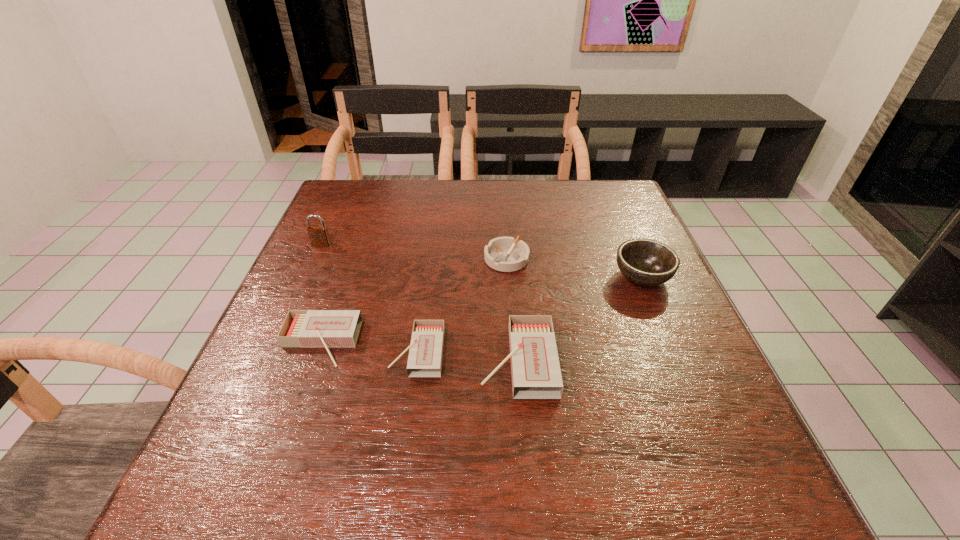
I want to click on matchbox that can be found as the closest to the rightmost matchbox, so click(x=426, y=348).